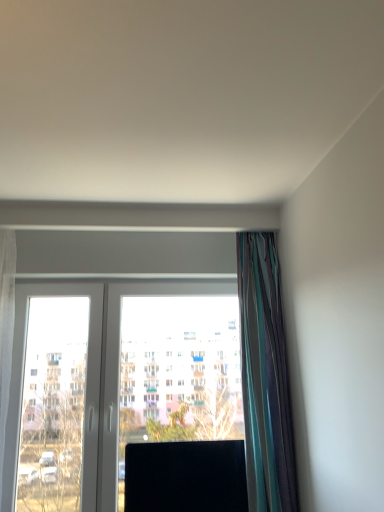
Question: In terms of height, does multicolored silky curtain at right look taller or shorter compared to black glossy screen at center?

Choices:
 (A) tall
 (B) short

Answer: (A)

Question: Relative to black glossy screen at center, is multicolored silky curtain at right in front or behind?

Choices:
 (A) front
 (B) behind

Answer: (A)

Question: Which object is the farthest from the transparent glass window at center?

Choices:
 (A) multicolored silky curtain at right
 (B) black glossy screen at center

Answer: (A)

Question: Which object is positioned farthest from the multicolored silky curtain at right?

Choices:
 (A) transparent glass window at center
 (B) black glossy screen at center

Answer: (B)